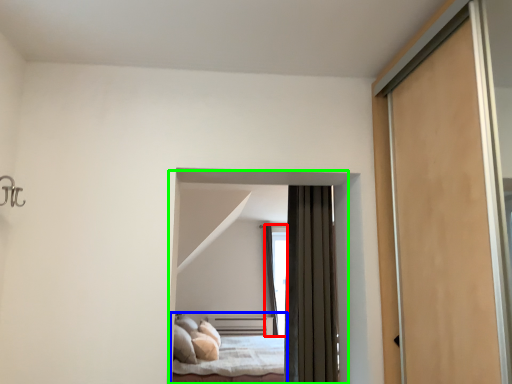
Question: Based on their relative distances, which object is nearer to window (highlighted by a red box)? Choose from bed (highlighted by a blue box) and bed (highlighted by a green box).

Choices:
 (A) bed
 (B) bed

Answer: (A)